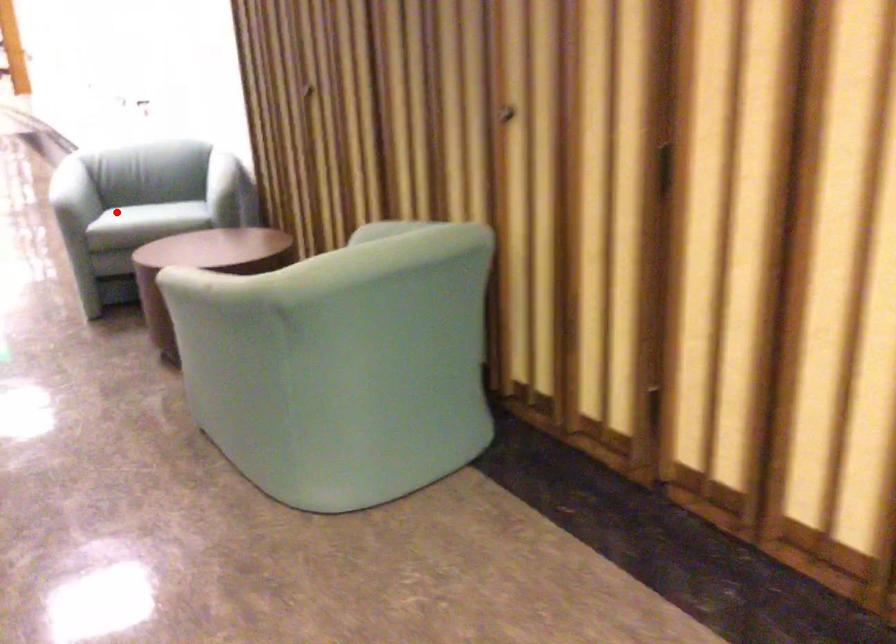
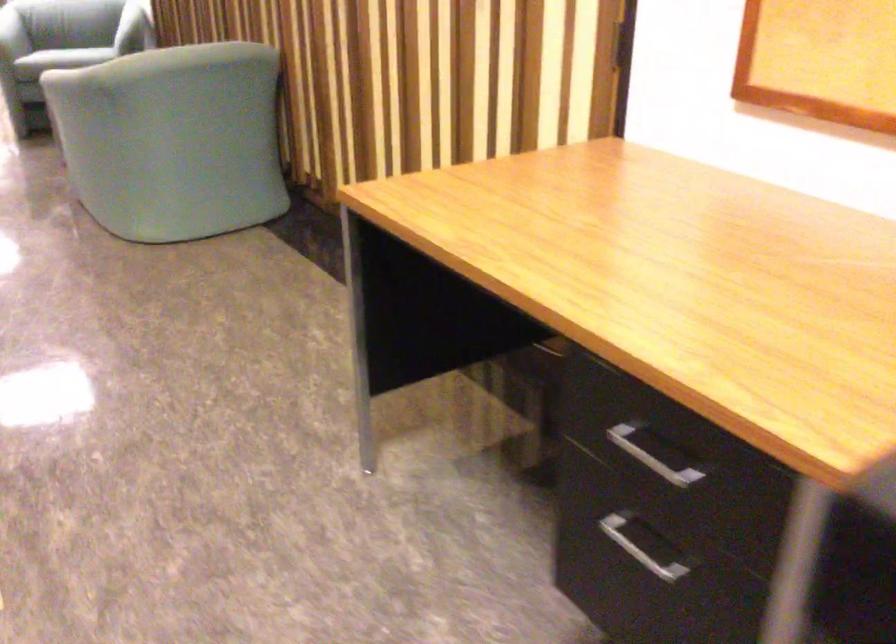
Where in the second image is the point corresponding to the highlighted location from the first image?

(12, 35)